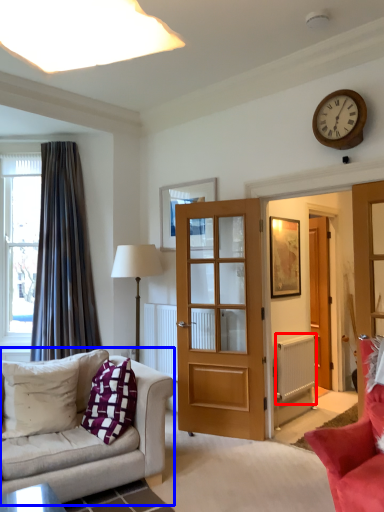
Question: Which point is further to the camera, radiator (highlighted by a red box) or studio couch (highlighted by a blue box)?

Choices:
 (A) radiator
 (B) studio couch

Answer: (A)